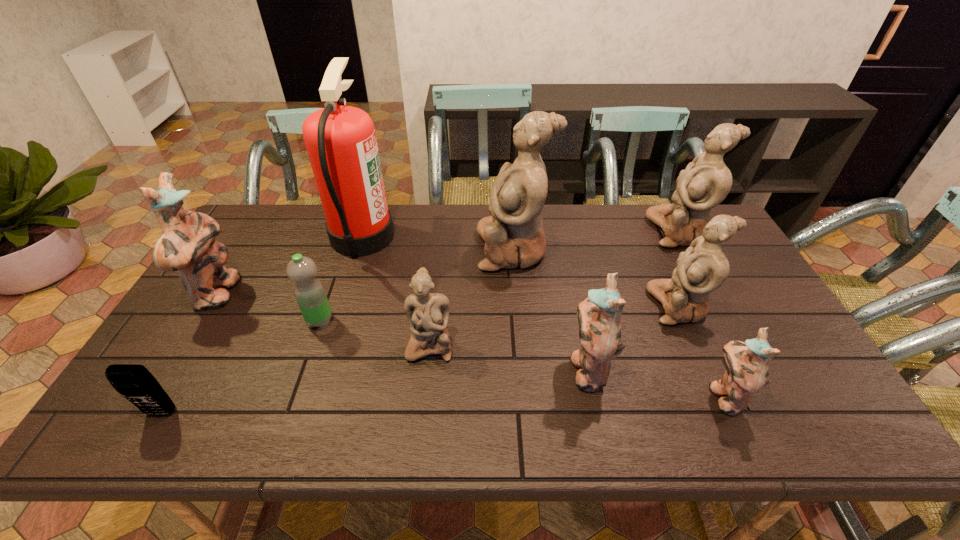
Locate an element on the screen. The width and height of the screenshot is (960, 540). free space located 0.220m on the front-facing side of the leftmost figurine is located at coordinates (314, 294).

Locate an element on the screen. This screenshot has width=960, height=540. free spot located on the front-facing side of the second pink figurine from left to right is located at coordinates (483, 369).

You are a GUI agent. You are given a task and a screenshot of the screen. Output one action in this format:
    pyautogui.click(x=<x>, y=<y>)
    Task: Click on the vacant space located 0.380m on the front-facing side of the second pink figurine from left to right
    
    Given the screenshot: What is the action you would take?
    pyautogui.click(x=415, y=369)

Find the location of a particular element. This screenshot has height=540, width=960. free space located on the front-facing side of the second pink figurine from left to right is located at coordinates (439, 369).

You are a GUI agent. You are given a task and a screenshot of the screen. Output one action in this format:
    pyautogui.click(x=<x>, y=<y>)
    Task: Click on the vacant space located 0.330m on the front-facing side of the third biggest white figurine
    This screenshot has width=960, height=540.
    Given the screenshot: What is the action you would take?
    pyautogui.click(x=534, y=306)

Where is `vacant space located on the front-facing side of the third biggest white figurine`? vacant space located on the front-facing side of the third biggest white figurine is located at coordinates (588, 306).

This screenshot has height=540, width=960. Find the location of `free space located on the front-facing side of the third biggest white figurine`. free space located on the front-facing side of the third biggest white figurine is located at coordinates coord(594,306).

Find the location of a particular element. Image resolution: width=960 pixels, height=540 pixels. free location located on the left of the green water bottle is located at coordinates (270, 321).

Locate an element on the screen. The image size is (960, 540). free space located on the front-facing side of the smallest white figurine is located at coordinates (426, 381).

Identify the location of free region located on the front-facing side of the smallest pink figurine. (637, 396).